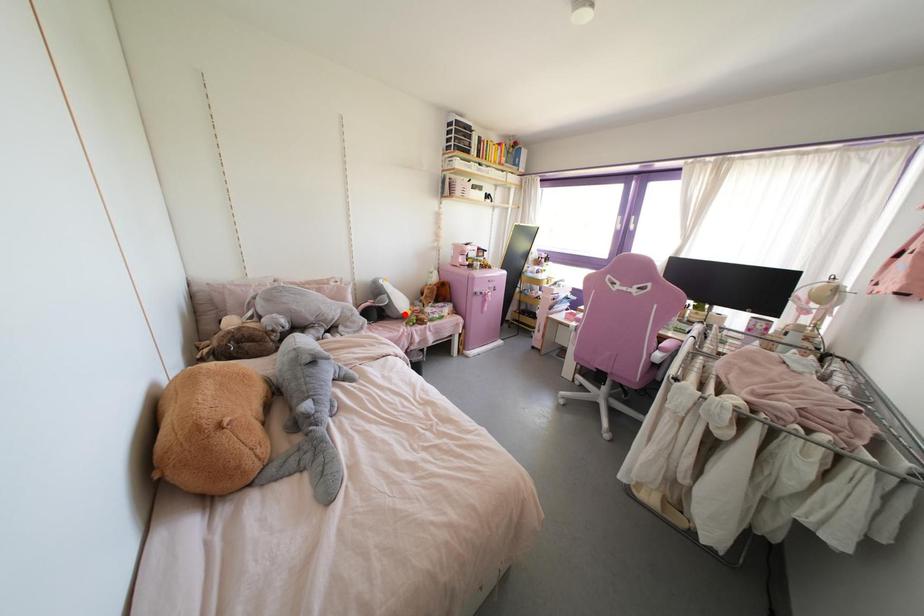
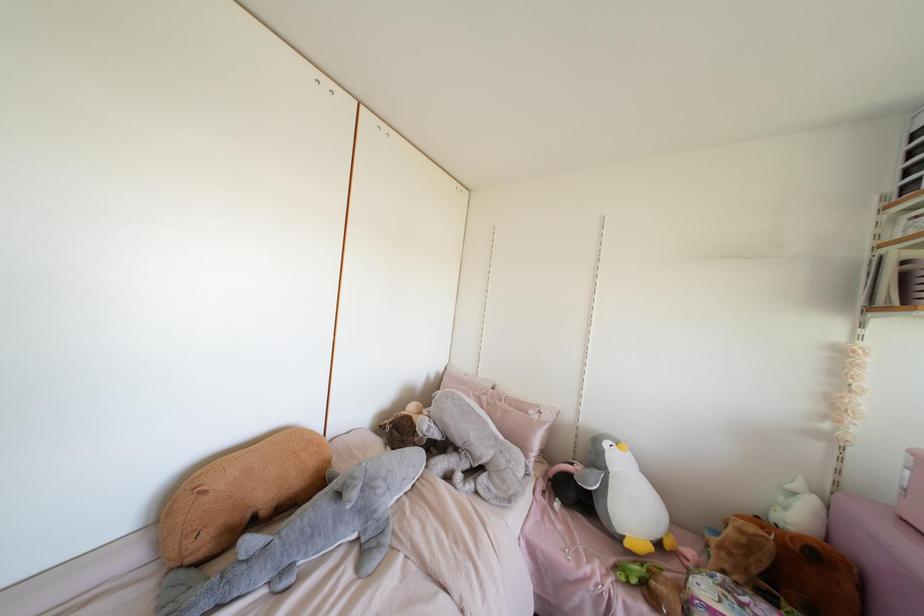
Locate, in the second image, the point that corresponds to the highlighted location in the first image.

(626, 544)